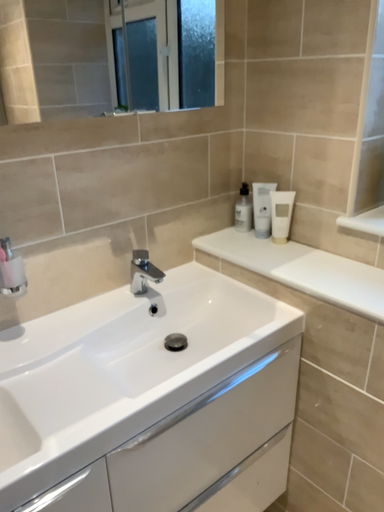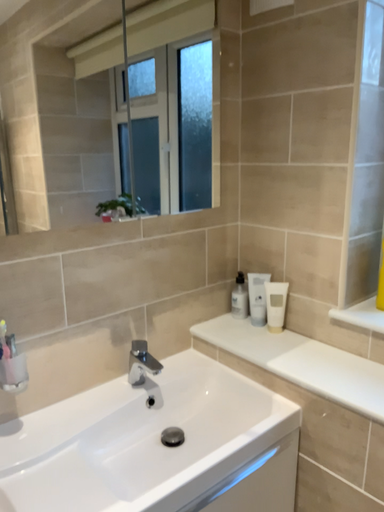
Question: Which way did the camera rotate in the video?

Choices:
 (A) rotated downward
 (B) rotated upward

Answer: (B)